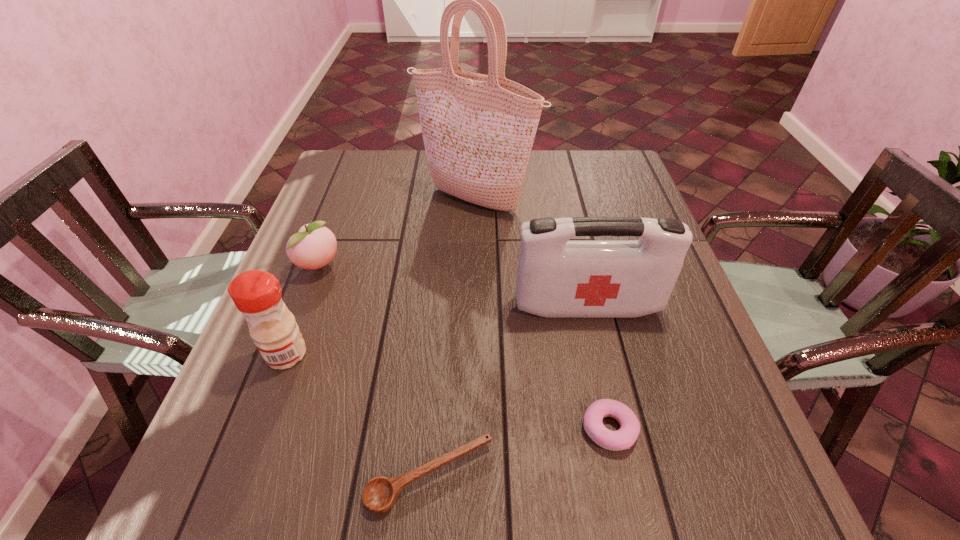
The height and width of the screenshot is (540, 960). I want to click on free spot between the fourth farthest object and the second shortest object, so click(448, 392).

Where is `free spot between the wooden spoon and the third farthest object`? This screenshot has height=540, width=960. free spot between the wooden spoon and the third farthest object is located at coordinates (509, 391).

This screenshot has width=960, height=540. What are the coordinates of `object that ranks as the fourth closest to the wooden spoon` in the screenshot? It's located at (314, 246).

Point out which object is positioned as the nearest to the pastry. Please provide its 2D coordinates. Your answer should be formatted as a tuple, i.e. [(x, y)], where the tuple contains the x and y coordinates of a point satisfying the conditions above.

[(380, 494)]

I want to click on free region that satisfies the following two spatial constraints: 1. on the front side of the second farthest object; 2. on the left side of the pastry, so click(258, 429).

Image resolution: width=960 pixels, height=540 pixels. What are the coordinates of `vacant space that satisfies the following two spatial constraints: 1. on the front side of the fifth nearest object; 2. on the right side of the condiment` in the screenshot? It's located at (286, 354).